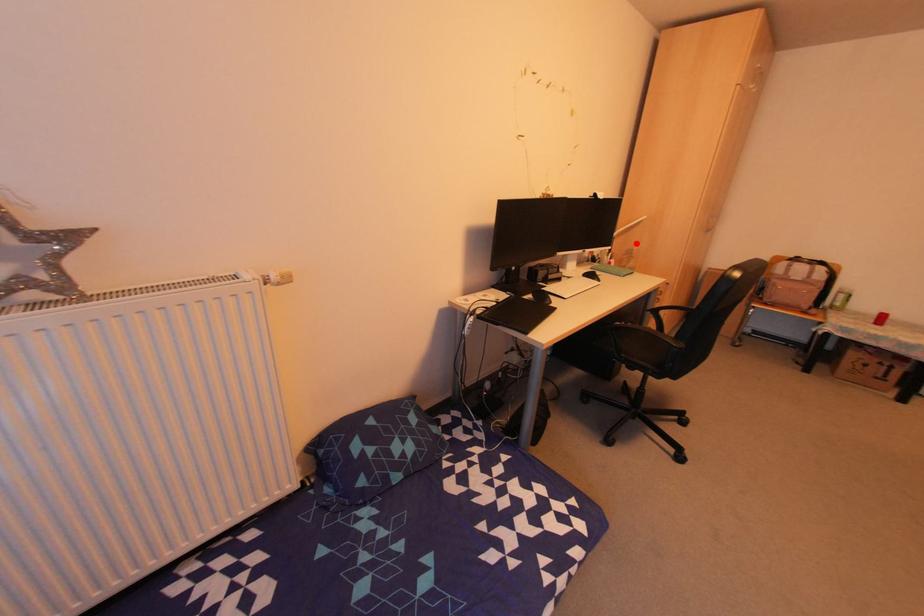
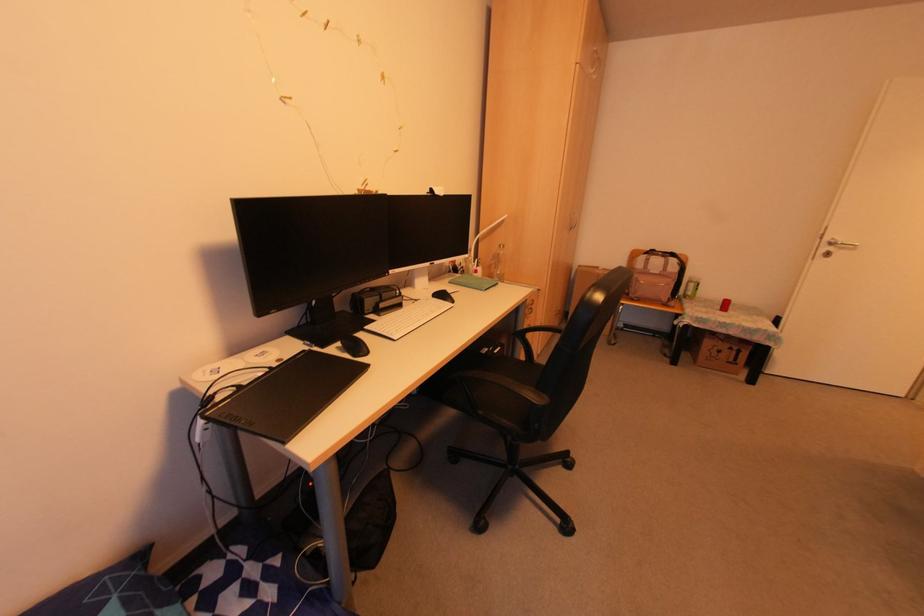
Locate, in the second image, the point that corresponds to the highlighted location in the first image.

(502, 246)